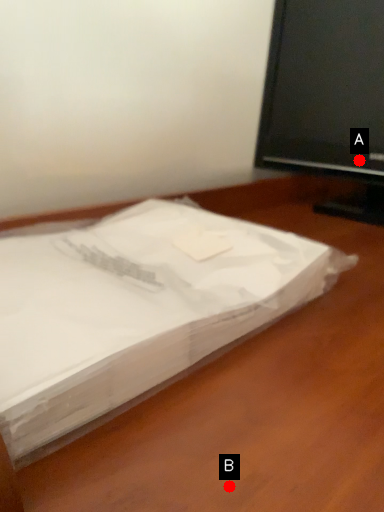
Question: Two points are circled on the image, labeled by A and B beside each circle. Which point is farther from the camera taking this photo?

Choices:
 (A) A is further
 (B) B is further

Answer: (A)